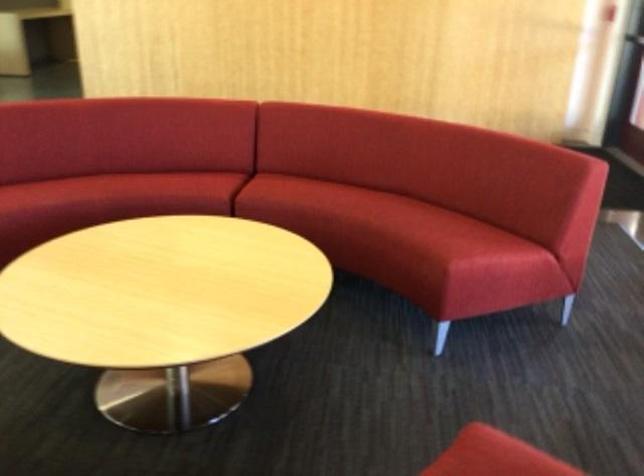
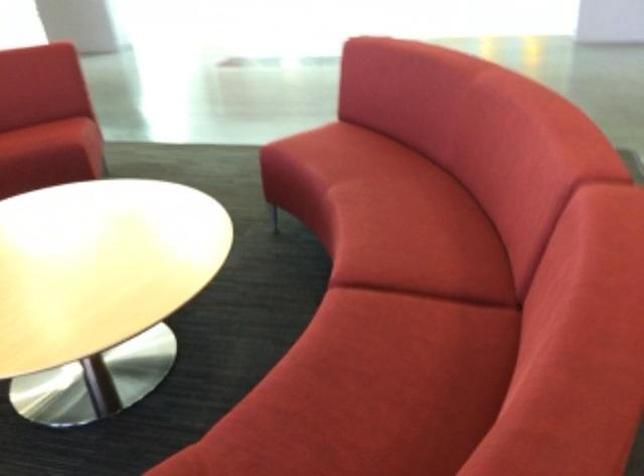
Where in the second image is the point corresponding to point (199, 178) from the first image?

(418, 239)